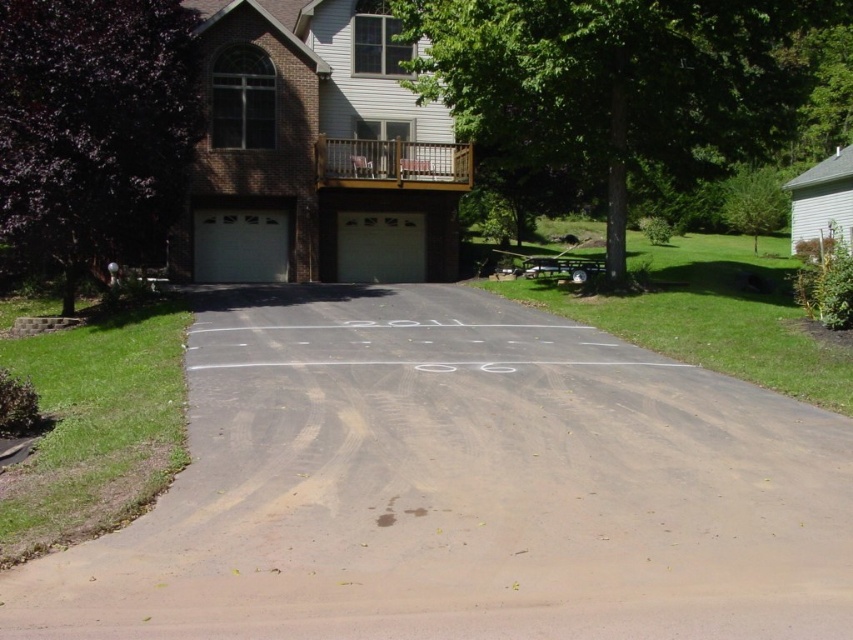
I want to click on brown asphalt driveway at center, so click(461, 486).

Between brown asphalt driveway at center and white matte garage door at center, which one is positioned higher?

Positioned higher is white matte garage door at center.

Where is `brown asphalt driveway at center`? brown asphalt driveway at center is located at coordinates (461, 486).

You are a GUI agent. You are given a task and a screenshot of the screen. Output one action in this format:
    pyautogui.click(x=<x>, y=<y>)
    Task: Click on the brown asphalt driveway at center
    This screenshot has width=853, height=640.
    Given the screenshot: What is the action you would take?
    pyautogui.click(x=461, y=486)

Can you confirm if green leafy tree at center is shorter than purple leafy tree at left?

In fact, green leafy tree at center may be taller than purple leafy tree at left.

Does green leafy tree at center appear under purple leafy tree at left?

No.

Where is `green leafy tree at center`? The height and width of the screenshot is (640, 853). green leafy tree at center is located at coordinates 612,83.

Does brown asphalt driveway at center appear under white smooth garage door at center?

Correct, brown asphalt driveway at center is located below white smooth garage door at center.

Which is in front, point (368, 381) or point (410, 248)?

Positioned in front is point (368, 381).

What are the coordinates of `brown asphalt driveway at center` in the screenshot? It's located at click(461, 486).